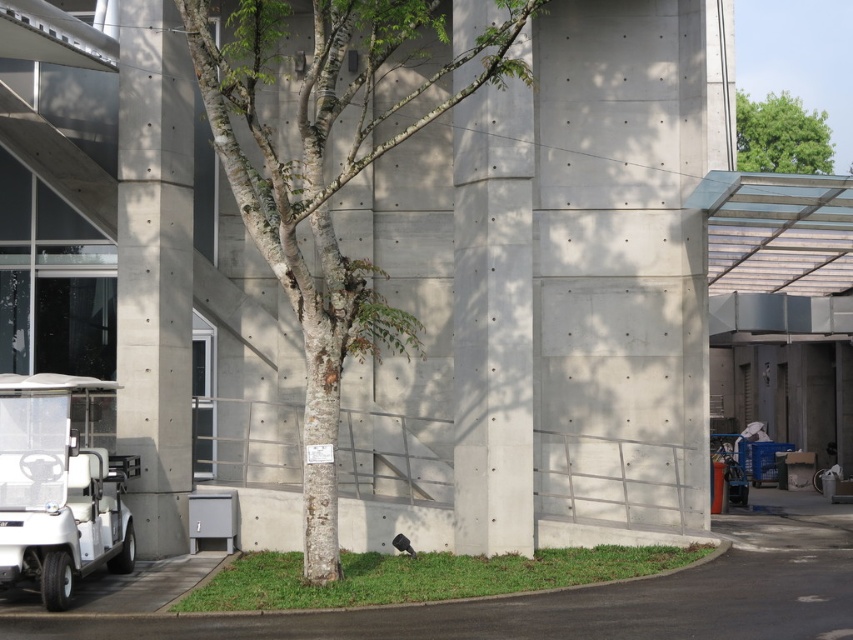
Does point (341, 276) come behind point (759, 122)?

No.

Is smooth bark tree at center in front of green leafy tree at upper right?

That is True.

Locate an element on the screen. The width and height of the screenshot is (853, 640). smooth bark tree at center is located at coordinates (331, 176).

Which of these two, concrete at center or concrete at left, stands taller?

With more height is concrete at left.

Is point (512, 136) in front of point (134, 195)?

Yes.

Identify the location of concrete at center. (492, 321).

This screenshot has height=640, width=853. In order to click on concrete at center in this screenshot , I will do `click(492, 321)`.

You are a GUI agent. You are given a task and a screenshot of the screen. Output one action in this format:
    pyautogui.click(x=<x>, y=<y>)
    Task: Click on the white matte golf cart at lower left
    
    Given the screenshot: What is the action you would take?
    pyautogui.click(x=57, y=484)

Based on the photo, can you confirm if white matte golf cart at lower left is positioned above green leafy tree at upper right?

Actually, white matte golf cart at lower left is below green leafy tree at upper right.

Describe the element at coordinates (57, 484) in the screenshot. I see `white matte golf cart at lower left` at that location.

Locate an element on the screen. The width and height of the screenshot is (853, 640). white matte golf cart at lower left is located at coordinates (x=57, y=484).